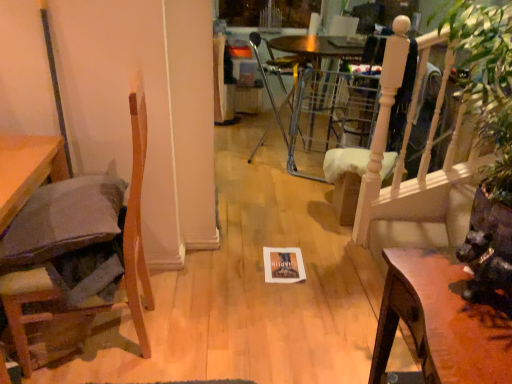
Question: Does wooden chair at left, the 2th chair from the back, have a greater width compared to metallic silver chair at center, marked as the 2th chair in a left-to-right arrangement?

Choices:
 (A) yes
 (B) no

Answer: (A)

Question: Does wooden chair at left, the 2th chair from the back, have a smaller size compared to metallic silver chair at center, which appears as the first chair when viewed from the back?

Choices:
 (A) yes
 (B) no

Answer: (B)

Question: From the image's perspective, does wooden chair at left, marked as the 1th chair in a front-to-back arrangement, appear lower than metallic silver chair at center, which appears as the first chair when viewed from the back?

Choices:
 (A) yes
 (B) no

Answer: (A)

Question: From a real-world perspective, is wooden chair at left, the 1th chair in the bottom-to-top sequence, located higher than metallic silver chair at center, marked as the 2th chair in a left-to-right arrangement?

Choices:
 (A) yes
 (B) no

Answer: (A)

Question: Considering the relative sizes of wooden chair at left, the 2th chair from the back, and metallic silver chair at center, marked as the 2th chair in a left-to-right arrangement, in the image provided, is wooden chair at left, the 2th chair from the back, bigger than metallic silver chair at center, marked as the 2th chair in a left-to-right arrangement,?

Choices:
 (A) yes
 (B) no

Answer: (A)

Question: In terms of width, does wooden chair at left, the 1th chair in the bottom-to-top sequence, look wider or thinner when compared to wooden table at lower right?

Choices:
 (A) thin
 (B) wide

Answer: (B)

Question: In the image, is wooden chair at left, marked as the 1th chair in a front-to-back arrangement, on the left side or the right side of wooden table at lower right?

Choices:
 (A) right
 (B) left

Answer: (B)

Question: Choose the correct answer: Is wooden chair at left, marked as the 1th chair in a left-to-right arrangement, inside wooden table at lower right or outside it?

Choices:
 (A) outside
 (B) inside

Answer: (A)

Question: From a real-world perspective, is wooden chair at left, the 2th chair from the back, physically located above or below wooden table at lower right?

Choices:
 (A) above
 (B) below

Answer: (A)

Question: Which is correct: wooden table at lower right is inside metallic silver chair at center, marked as the 2th chair in a left-to-right arrangement, or outside of it?

Choices:
 (A) outside
 (B) inside

Answer: (A)

Question: From a real-world perspective, is wooden table at lower right positioned above or below metallic silver chair at center, positioned as the first chair in top-to-bottom order?

Choices:
 (A) below
 (B) above

Answer: (A)

Question: Considering their positions, is wooden table at lower right located in front of or behind metallic silver chair at center, which appears as the first chair when viewed from the back?

Choices:
 (A) behind
 (B) front

Answer: (B)

Question: Considering the positions of wooden table at lower right and metallic silver chair at center, positioned as the first chair in top-to-bottom order, in the image, is wooden table at lower right wider or thinner than metallic silver chair at center, positioned as the first chair in top-to-bottom order,?

Choices:
 (A) thin
 (B) wide

Answer: (A)

Question: Does point (285, 61) appear closer or farther from the camera than point (6, 291)?

Choices:
 (A) closer
 (B) farther

Answer: (B)

Question: Considering the positions of metallic silver chair at center, positioned as the 2th chair in front-to-back order, and wooden chair at left, which is counted as the 2th chair, starting from the right, in the image, is metallic silver chair at center, positioned as the 2th chair in front-to-back order, wider or thinner than wooden chair at left, which is counted as the 2th chair, starting from the right,?

Choices:
 (A) thin
 (B) wide

Answer: (A)